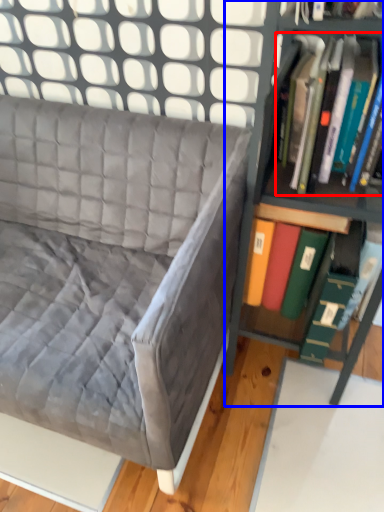
Question: Which of the following is the closest to the observer, book (highlighted by a red box) or shelf (highlighted by a blue box)?

Choices:
 (A) book
 (B) shelf

Answer: (B)